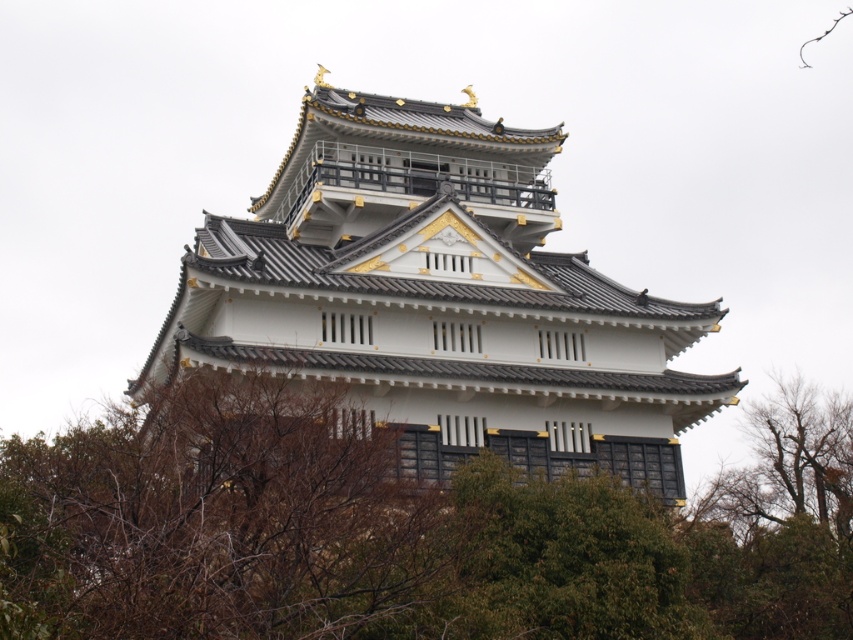
Question: Which object is farther from the camera taking this photo?

Choices:
 (A) green leafy tree at center
 (B) white painted wood tower at center

Answer: (B)

Question: Is green leafy tree at center to the left of white painted wood tower at center from the viewer's perspective?

Choices:
 (A) no
 (B) yes

Answer: (B)

Question: Which object appears farthest from the camera in this image?

Choices:
 (A) white painted wood tower at center
 (B) green leafy tree at center

Answer: (A)

Question: Does green leafy tree at center have a smaller size compared to white painted wood tower at center?

Choices:
 (A) yes
 (B) no

Answer: (B)

Question: Is green leafy tree at center below white painted wood tower at center?

Choices:
 (A) no
 (B) yes

Answer: (B)